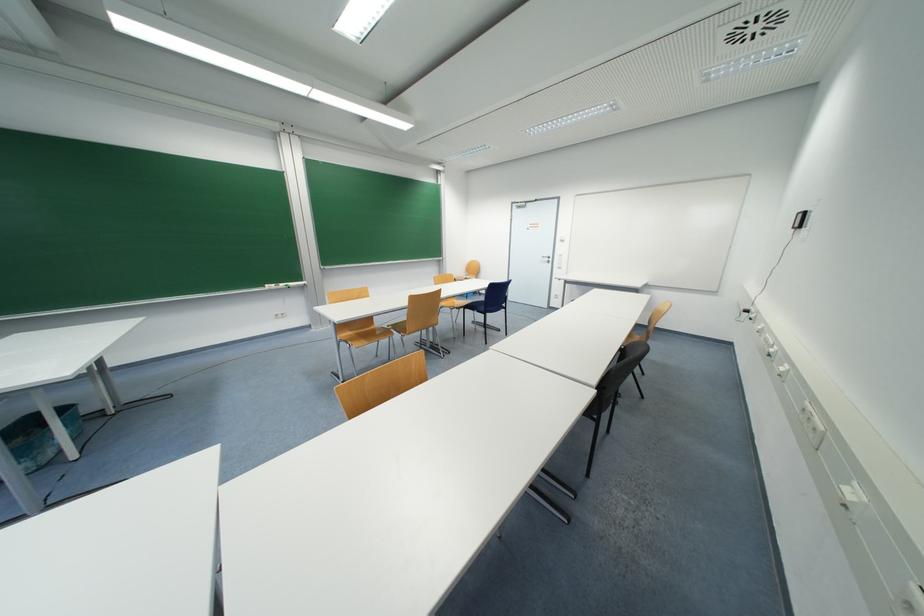
The location [39,437] corresponds to which object?

It refers to a blue trash bin.